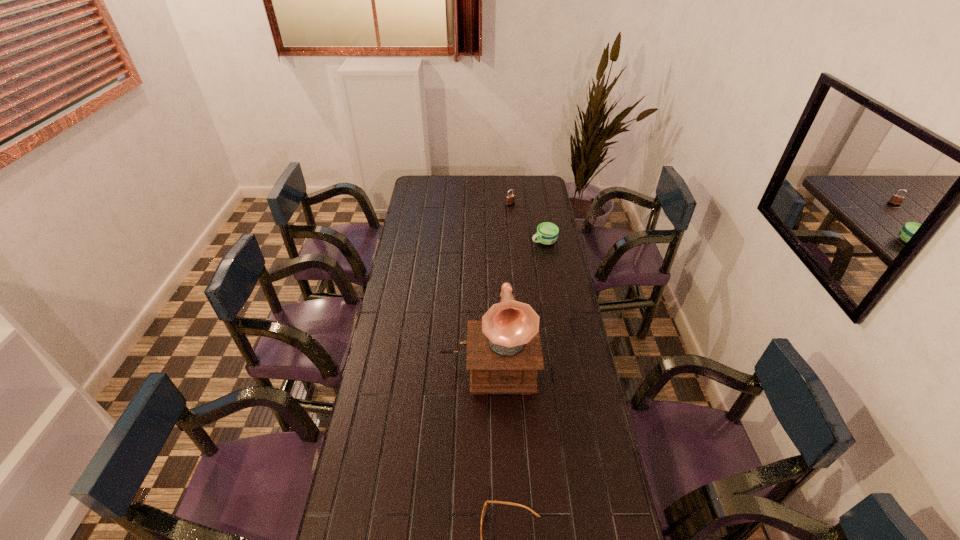
The width and height of the screenshot is (960, 540). In the image, there is a desktop. In order to click on vacant region at the left edge in this screenshot , I will do `click(388, 288)`.

In the image, there is a desktop. What are the coordinates of `free region at the right edge` in the screenshot? It's located at (549, 255).

This screenshot has width=960, height=540. In the image, there is a desktop. Find the location of `blank space at the far left corner`. blank space at the far left corner is located at coordinates (431, 192).

Where is `free space between the farthest object and the tallest object`? This screenshot has height=540, width=960. free space between the farthest object and the tallest object is located at coordinates pos(499,285).

In order to click on free space between the padlock and the record player in this screenshot , I will do `click(499, 285)`.

Identify the location of the third closest object to the shortest object. The width and height of the screenshot is (960, 540). (510, 199).

Identify which object is the nearest to the record player. Please provide its 2D coordinates. Your answer should be formatted as a tuple, i.e. [(x, y)], where the tuple contains the x and y coordinates of a point satisfying the conditions above.

[(501, 502)]